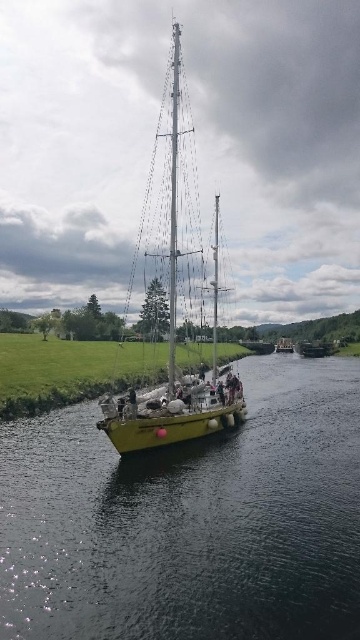
You are a photographer standing on the riverside. You want to take a photo of the smooth yellow boat at center and the metallic silver mast at center. Which object should you focus on first if you want to capture both in the same frame without moving your camera?

The smooth yellow boat at center is positioned under the metallic silver mast at center, so you should focus on the metallic silver mast at center first to ensure both are in the frame.

You are a drone operator who needs to capture a photo of the smooth yellow boat at center from directly above. Given the boat is at coordinates point 0.814, 0.528, what is the best way to position the drone to ensure it captures the boat without any obstructions?

The smooth yellow boat at center is located at point (x=190, y=520), so the drone should be positioned directly above this coordinate to capture the boat without obstructions.